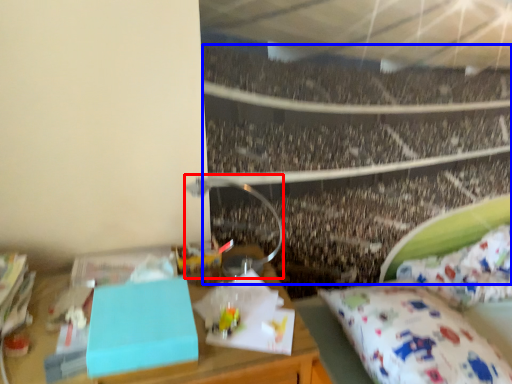
Question: Which object appears closest to the camera in this image, lamp (highlighted by a red box) or crowd (highlighted by a blue box)?

Choices:
 (A) lamp
 (B) crowd

Answer: (A)